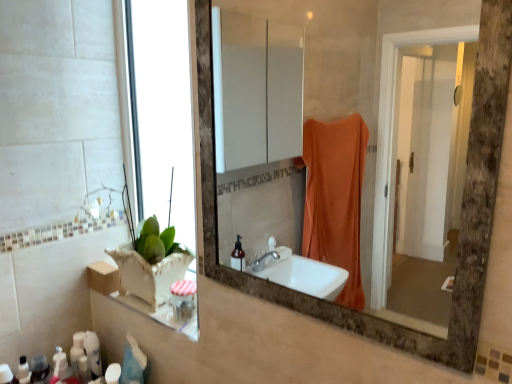
The width and height of the screenshot is (512, 384). What do you see at coordinates (23, 371) in the screenshot?
I see `matte white lotion at lower left, the 1th toiletry in the left-to-right sequence` at bounding box center [23, 371].

In order to face matte brown mirror at center, should I rotate leftwards or rightwards?

To face it directly, rotate right by 8.231 degrees.

Where is `white matte bottle at lower left, positioned as the 1th toiletry in right-to-left order`? This screenshot has width=512, height=384. white matte bottle at lower left, positioned as the 1th toiletry in right-to-left order is located at coordinates (113, 373).

Can you tell me how much matte white lotion at lower left, the 1th toiletry in the left-to-right sequence, and matte brown mirror at center differ in facing direction?

The angular difference between matte white lotion at lower left, the 1th toiletry in the left-to-right sequence, and matte brown mirror at center is 91.7 degrees.

Is matte white lotion at lower left, the 1th toiletry in the left-to-right sequence, placed right next to matte brown mirror at center?

No, matte white lotion at lower left, the 1th toiletry in the left-to-right sequence, is not next to matte brown mirror at center.

Can you confirm if matte white lotion at lower left, the 1th toiletry in the left-to-right sequence, is positioned to the left of matte brown mirror at center?

Yes, matte white lotion at lower left, the 1th toiletry in the left-to-right sequence, is to the left of matte brown mirror at center.

The width and height of the screenshot is (512, 384). What are the coordinates of `mirror in front of the matte white lotion at lower left, the 2th toiletry from the right` in the screenshot? It's located at (407, 155).

Where is `toiletry behind the white matte bottle at lower left, placed as the 2th toiletry when sorted from left to right`? This screenshot has height=384, width=512. toiletry behind the white matte bottle at lower left, placed as the 2th toiletry when sorted from left to right is located at coordinates (23, 371).

Which object is further away from the camera taking this photo, matte white lotion at lower left, the 2th toiletry from the right, or white matte bottle at lower left, placed as the 2th toiletry when sorted from left to right?

matte white lotion at lower left, the 2th toiletry from the right, is behind.

How far apart are matte white lotion at lower left, the 2th toiletry from the right, and white matte bottle at lower left, positioned as the 1th toiletry in right-to-left order?

The distance of matte white lotion at lower left, the 2th toiletry from the right, from white matte bottle at lower left, positioned as the 1th toiletry in right-to-left order, is 9.56 inches.

From the image's perspective, is matte white lotion at lower left, the 1th toiletry in the left-to-right sequence, beneath white matte bottle at lower left, positioned as the 1th toiletry in right-to-left order?

No, from the image's perspective, matte white lotion at lower left, the 1th toiletry in the left-to-right sequence, is not below white matte bottle at lower left, positioned as the 1th toiletry in right-to-left order.

From the image's perspective, is matte brown mirror at center positioned above or below matte white lotion at lower left, the 1th toiletry in the left-to-right sequence?

From the image's perspective, matte brown mirror at center appears above matte white lotion at lower left, the 1th toiletry in the left-to-right sequence.

Who is bigger, matte brown mirror at center or matte white lotion at lower left, the 1th toiletry in the left-to-right sequence?

matte brown mirror at center is bigger.

Looking at this image, which is correct: matte brown mirror at center is inside matte white lotion at lower left, the 1th toiletry in the left-to-right sequence, or outside of it?

matte brown mirror at center cannot be found inside matte white lotion at lower left, the 1th toiletry in the left-to-right sequence.

Where is `mirror above the matte white lotion at lower left, the 2th toiletry from the right (from the image's perspective)`? This screenshot has width=512, height=384. mirror above the matte white lotion at lower left, the 2th toiletry from the right (from the image's perspective) is located at coordinates (407, 155).

Is matte brown mirror at center aimed at white matte bottle at lower left, placed as the 2th toiletry when sorted from left to right?

No, matte brown mirror at center is not oriented towards white matte bottle at lower left, placed as the 2th toiletry when sorted from left to right.

Consider the image. Who is bigger, matte brown mirror at center or white matte bottle at lower left, positioned as the 1th toiletry in right-to-left order?

Bigger between the two is matte brown mirror at center.

Does point (404, 51) lie behind point (106, 373)?

Yes.

From the picture: Can you confirm if white matte bottle at lower left, positioned as the 1th toiletry in right-to-left order, is taller than matte white lotion at lower left, the 2th toiletry from the right?

Correct, white matte bottle at lower left, positioned as the 1th toiletry in right-to-left order, is much taller as matte white lotion at lower left, the 2th toiletry from the right.

Is white matte bottle at lower left, positioned as the 1th toiletry in right-to-left order, not near matte white lotion at lower left, the 2th toiletry from the right?

No, white matte bottle at lower left, positioned as the 1th toiletry in right-to-left order, is not far away from matte white lotion at lower left, the 2th toiletry from the right.

From a real-world perspective, is white matte bottle at lower left, placed as the 2th toiletry when sorted from left to right, positioned under matte white lotion at lower left, the 2th toiletry from the right, based on gravity?

Actually, white matte bottle at lower left, placed as the 2th toiletry when sorted from left to right, is physically above matte white lotion at lower left, the 2th toiletry from the right, in the real world.

The width and height of the screenshot is (512, 384). In order to click on toiletry directly beneath the white matte bottle at lower left, positioned as the 1th toiletry in right-to-left order (from a real-world perspective) in this screenshot , I will do `click(23, 371)`.

In the scene shown: Is matte brown mirror at center a part of white matte bottle at lower left, placed as the 2th toiletry when sorted from left to right?

No, white matte bottle at lower left, placed as the 2th toiletry when sorted from left to right, does not contain matte brown mirror at center.

From a real-world perspective, is white matte bottle at lower left, positioned as the 1th toiletry in right-to-left order, located beneath matte brown mirror at center?

Correct, in the physical world, white matte bottle at lower left, positioned as the 1th toiletry in right-to-left order, is lower than matte brown mirror at center.

From the image's perspective, is white matte bottle at lower left, positioned as the 1th toiletry in right-to-left order, under matte brown mirror at center?

Indeed, from the image's perspective, white matte bottle at lower left, positioned as the 1th toiletry in right-to-left order, is shown beneath matte brown mirror at center.

Which object is further away from the camera taking this photo, white matte bottle at lower left, placed as the 2th toiletry when sorted from left to right, or matte brown mirror at center?

white matte bottle at lower left, placed as the 2th toiletry when sorted from left to right, is further away from the camera.

Find the location of a particular element. mirror above the matte white lotion at lower left, the 1th toiletry in the left-to-right sequence (from the image's perspective) is located at coordinates (407, 155).

The height and width of the screenshot is (384, 512). I want to click on toiletry on the left of white matte bottle at lower left, positioned as the 1th toiletry in right-to-left order, so click(x=23, y=371).

Estimate the real-world distances between objects in this image. Which object is further from matte brown mirror at center, matte white lotion at lower left, the 2th toiletry from the right, or white matte bottle at lower left, placed as the 2th toiletry when sorted from left to right?

Based on the image, matte white lotion at lower left, the 2th toiletry from the right, appears to be further to matte brown mirror at center.

From the image, which object appears to be nearer to matte white lotion at lower left, the 1th toiletry in the left-to-right sequence, matte brown mirror at center or white matte bottle at lower left, placed as the 2th toiletry when sorted from left to right?

white matte bottle at lower left, placed as the 2th toiletry when sorted from left to right, lies closer to matte white lotion at lower left, the 1th toiletry in the left-to-right sequence, than the other object.

Which object lies further to the anchor point white matte bottle at lower left, positioned as the 1th toiletry in right-to-left order, matte brown mirror at center or matte white lotion at lower left, the 2th toiletry from the right?

matte brown mirror at center lies further to white matte bottle at lower left, positioned as the 1th toiletry in right-to-left order, than the other object.

When comparing their distances from white matte bottle at lower left, positioned as the 1th toiletry in right-to-left order, does matte white lotion at lower left, the 1th toiletry in the left-to-right sequence, or matte brown mirror at center seem closer?

matte white lotion at lower left, the 1th toiletry in the left-to-right sequence, is closer to white matte bottle at lower left, positioned as the 1th toiletry in right-to-left order.

From the image, which object appears to be nearer to matte white lotion at lower left, the 2th toiletry from the right, white matte bottle at lower left, placed as the 2th toiletry when sorted from left to right, or matte brown mirror at center?

white matte bottle at lower left, placed as the 2th toiletry when sorted from left to right.

From the picture: Looking at the image, which one is located further to matte brown mirror at center, white matte bottle at lower left, positioned as the 1th toiletry in right-to-left order, or matte white lotion at lower left, the 1th toiletry in the left-to-right sequence?

Among the two, matte white lotion at lower left, the 1th toiletry in the left-to-right sequence, is located further to matte brown mirror at center.

I want to click on toiletry located between matte white lotion at lower left, the 2th toiletry from the right, and matte brown mirror at center in the left-right direction, so click(113, 373).